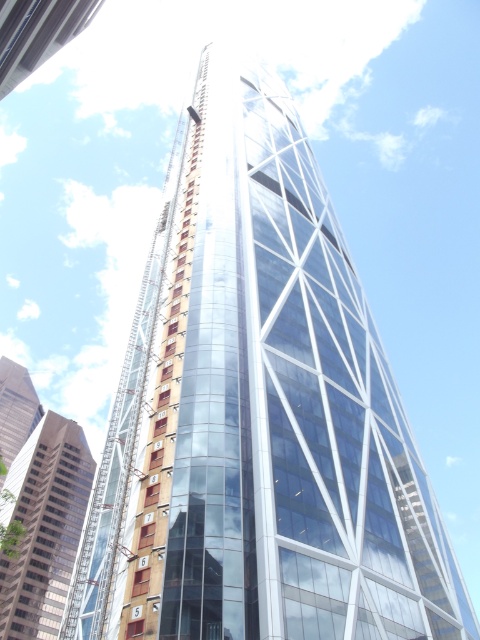
Is glassy reflective building at lower left shorter than transparent glass tower at upper left?

Incorrect, glassy reflective building at lower left's height does not fall short of transparent glass tower at upper left's.

Between glassy reflective building at lower left and transparent glass tower at upper left, which one is positioned higher?

Positioned higher is transparent glass tower at upper left.

This screenshot has width=480, height=640. What are the coordinates of `glassy reflective building at lower left` in the screenshot? It's located at (44, 525).